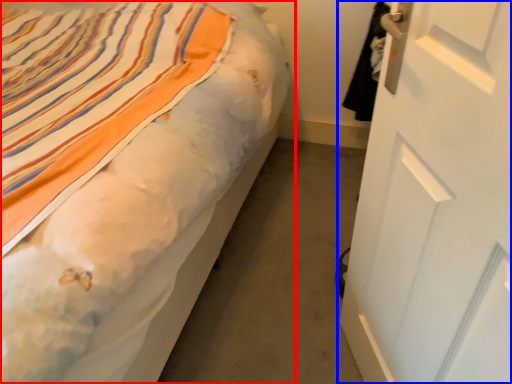
Question: Among these objects, which one is nearest to the camera, bed (highlighted by a red box) or door (highlighted by a blue box)?

Choices:
 (A) bed
 (B) door

Answer: (B)